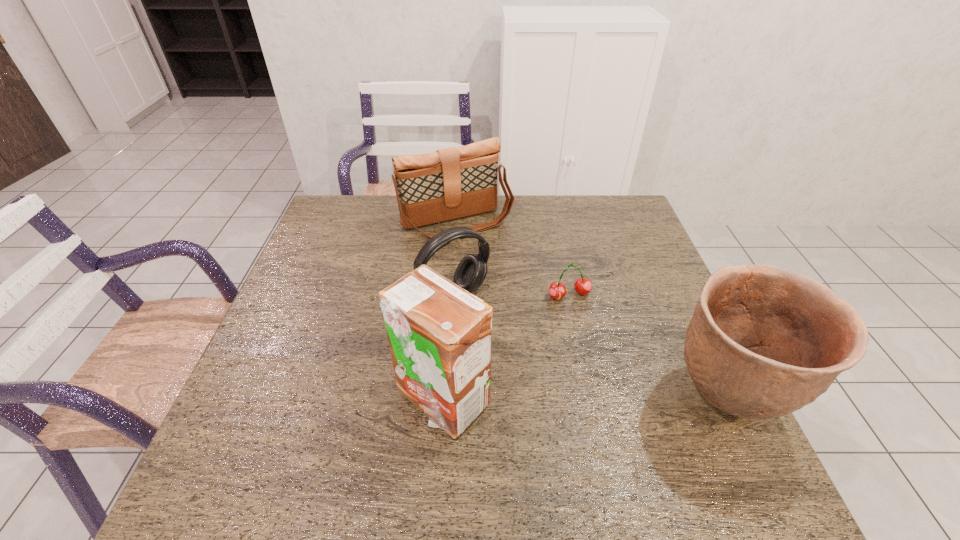
The image size is (960, 540). In order to click on empty location between the farthest object and the pottery in this screenshot , I will do `click(590, 310)`.

Locate an element on the screen. Image resolution: width=960 pixels, height=540 pixels. empty location between the shoulder bag and the shortest object is located at coordinates (513, 259).

Find the location of `free space between the carton and the shortest object`. free space between the carton and the shortest object is located at coordinates (506, 347).

Locate an element on the screen. The image size is (960, 540). free space between the rightmost object and the farthest object is located at coordinates (590, 310).

Image resolution: width=960 pixels, height=540 pixels. In order to click on vacant area between the farthest object and the rightmost object in this screenshot , I will do `click(590, 310)`.

Find the location of a particular element. free area in between the rightmost object and the shoulder bag is located at coordinates (590, 310).

Image resolution: width=960 pixels, height=540 pixels. I want to click on unoccupied area between the carton and the pottery, so click(x=584, y=399).

Select which object appears as the third closest to the cherry. Please provide its 2D coordinates. Your answer should be formatted as a tuple, i.e. [(x, y)], where the tuple contains the x and y coordinates of a point satisfying the conditions above.

[(448, 184)]

Choose which object is the second nearest neighbor to the fourth object from left to right. Please provide its 2D coordinates. Your answer should be formatted as a tuple, i.e. [(x, y)], where the tuple contains the x and y coordinates of a point satisfying the conditions above.

[(764, 341)]

Find the location of a particular element. The image size is (960, 540). vacant space that satisfies the following two spatial constraints: 1. on the front side of the rightmost object; 2. on the left side of the headset is located at coordinates (448, 399).